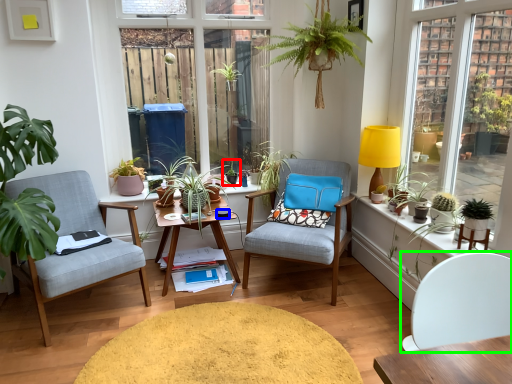
Question: Which object is positioned farthest from houseplant (highlighted by a red box)? Select from coffee cup (highlighted by a blue box) and chair (highlighted by a green box).

Choices:
 (A) coffee cup
 (B) chair

Answer: (B)